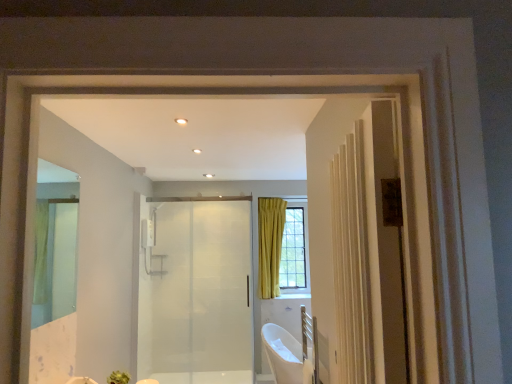
You are a GUI agent. You are given a task and a screenshot of the screen. Output one action in this format:
    pyautogui.click(x=<x>, y=<y>)
    Task: Click on the white glossy bathtub at lower center
    The image size is (512, 384).
    Given the screenshot: What is the action you would take?
    pyautogui.click(x=288, y=359)

Considering the sizes of white glossy bathtub at lower center and transparent glass door at center in the image, is white glossy bathtub at lower center taller or shorter than transparent glass door at center?

white glossy bathtub at lower center is shorter than transparent glass door at center.

How different are the orientations of white glossy bathtub at lower center and transparent glass door at center in degrees?

white glossy bathtub at lower center and transparent glass door at center are facing 62.4 degrees away from each other.

Is white glossy bathtub at lower center inside the boundaries of transparent glass door at center, or outside?

white glossy bathtub at lower center is spatially situated outside transparent glass door at center.

Considering the sizes of objects white glossy bathtub at lower center and transparent glass door at center in the image provided, who is wider, white glossy bathtub at lower center or transparent glass door at center?

Wider between the two is white glossy bathtub at lower center.

Is clear glass mirror at left beside white glossy bathtub at lower center?

clear glass mirror at left and white glossy bathtub at lower center are not in contact.

Where is `mirror on the left of the white glossy bathtub at lower center`? mirror on the left of the white glossy bathtub at lower center is located at coordinates (55, 243).

Looking at this image, could you tell me if clear glass mirror at left is turned towards white glossy bathtub at lower center?

No, clear glass mirror at left is not turned towards white glossy bathtub at lower center.

Can white glossy bathtub at lower center be found inside clear glass mirror at left?

No, white glossy bathtub at lower center is located outside of clear glass mirror at left.

Would you say transparent glass door at center is inside or outside clear glass mirror at left?

transparent glass door at center cannot be found inside clear glass mirror at left.

From a real-world perspective, is transparent glass door at center beneath clear glass mirror at left?

Yes, from a real-world perspective, transparent glass door at center is below clear glass mirror at left.

Is transparent glass door at center oriented towards clear glass mirror at left?

Yes.

Is point (143, 269) positioned before point (37, 199)?

No, (143, 269) is behind (37, 199).

From the image's perspective, which is below, transparent glass door at center or white glossy bathtub at lower center?

From the image's view, white glossy bathtub at lower center is below.

From a real-world perspective, does transparent glass door at center sit lower than white glossy bathtub at lower center?

No.

Does point (178, 375) lie in front of point (273, 373)?

No, (178, 375) is behind (273, 373).

Can you tell me how much transparent glass door at center and white glossy bathtub at lower center differ in facing direction?

62.4 degrees separate the facing orientations of transparent glass door at center and white glossy bathtub at lower center.

From the image's perspective, between white glossy bathtub at lower center and clear glass mirror at left, which one is located above?

clear glass mirror at left is shown above in the image.

Can you confirm if white glossy bathtub at lower center is wider than clear glass mirror at left?

Yes.

Is white glossy bathtub at lower center turned away from clear glass mirror at left?

No, clear glass mirror at left is not at the back of white glossy bathtub at lower center.

Does point (282, 336) appear closer or farther from the camera than point (46, 217)?

Point (282, 336) is farther from the camera than point (46, 217).

Does clear glass mirror at left turn towards transparent glass door at center?

No.

Are clear glass mirror at left and transparent glass door at center beside each other?

No, clear glass mirror at left is not in contact with transparent glass door at center.

From the picture: From the image's perspective, which object appears higher, clear glass mirror at left or transparent glass door at center?

clear glass mirror at left.

Would you say clear glass mirror at left is to the left or to the right of transparent glass door at center in the picture?

Based on their positions, clear glass mirror at left is located to the left of transparent glass door at center.

Find the location of `door on the left of white glossy bathtub at lower center`. door on the left of white glossy bathtub at lower center is located at coordinates (196, 293).

Find the location of a particular element. This screenshot has width=512, height=384. bath located behind the clear glass mirror at left is located at coordinates (288, 359).

Which object lies nearer to the anchor point white glossy bathtub at lower center, clear glass mirror at left or transparent glass door at center?

transparent glass door at center lies closer to white glossy bathtub at lower center than the other object.

Looking at the image, which one is located further to transparent glass door at center, white glossy bathtub at lower center or clear glass mirror at left?

clear glass mirror at left lies further to transparent glass door at center than the other object.

From the image, which object appears to be farther from clear glass mirror at left, white glossy bathtub at lower center or transparent glass door at center?

Based on the image, white glossy bathtub at lower center appears to be further to clear glass mirror at left.

When comparing their distances from white glossy bathtub at lower center, does transparent glass door at center or clear glass mirror at left seem closer?

A: transparent glass door at center lies closer to white glossy bathtub at lower center than the other object.

Looking at the image, which one is located further to transparent glass door at center, clear glass mirror at left or white glossy bathtub at lower center?

clear glass mirror at left.

Estimate the real-world distances between objects in this image. Which object is closer to clear glass mirror at left, transparent glass door at center or white glossy bathtub at lower center?

transparent glass door at center lies closer to clear glass mirror at left than the other object.

You are a GUI agent. You are given a task and a screenshot of the screen. Output one action in this format:
    pyautogui.click(x=<x>, y=<y>)
    Task: Click on the bath between clear glass mirror at left and transparent glass door at center from front to back
    
    Given the screenshot: What is the action you would take?
    pyautogui.click(x=288, y=359)